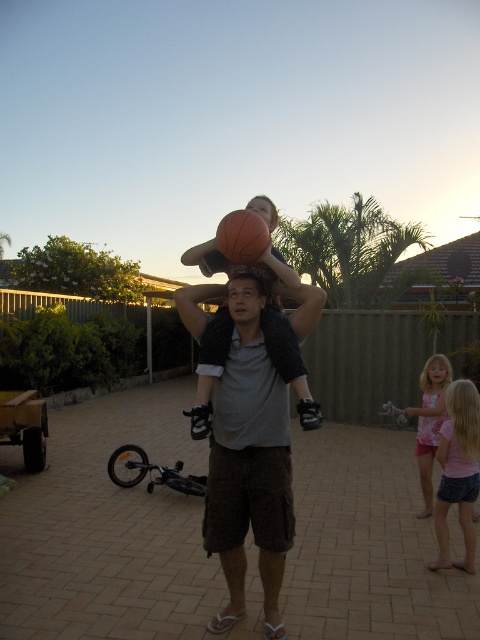
Who is shorter, pink fabric dress at lower right or orange matte basketball at center?

orange matte basketball at center is shorter.

Does point (399, 412) come in front of point (253, 234)?

No, it is not.

Describe the element at coordinates (427, 420) in the screenshot. The height and width of the screenshot is (640, 480). I see `pink fabric dress at lower right` at that location.

Identify the location of pink fabric dress at lower right. The image size is (480, 640). (427, 420).

Is the position of orange matte basketball at center more distant than that of matte gray head at center?

No, orange matte basketball at center is in front of matte gray head at center.

Is orange matte basketball at center closer to the viewer compared to matte gray head at center?

Yes, it is in front of matte gray head at center.

The height and width of the screenshot is (640, 480). What do you see at coordinates (241, 236) in the screenshot?
I see `orange matte basketball at center` at bounding box center [241, 236].

Locate an element on the screen. Image resolution: width=480 pixels, height=640 pixels. orange matte basketball at center is located at coordinates point(241,236).

Is the position of matte black shirt at center more distant than that of matte orange basketball at center?

No, matte black shirt at center is closer to the viewer.

Which is behind, point (212, 356) or point (264, 214)?

The point (264, 214) is behind.

Where is `matte black shirt at center`? Image resolution: width=480 pixels, height=640 pixels. matte black shirt at center is located at coordinates (268, 317).

Where is `matte black shirt at center`? matte black shirt at center is located at coordinates (268, 317).